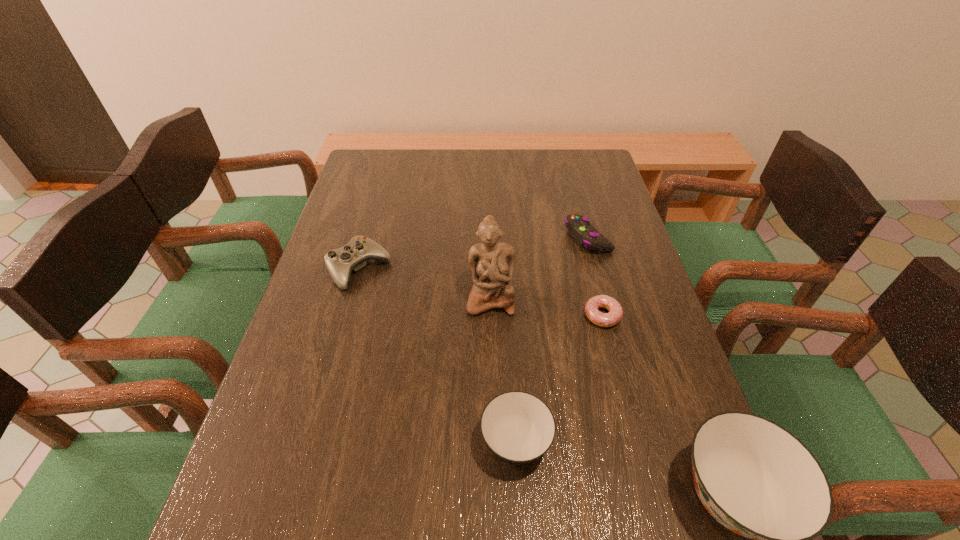
Image resolution: width=960 pixels, height=540 pixels. In the image, there is a desktop. Find the location of `vacant area at the near right corner`. vacant area at the near right corner is located at coordinates (667, 460).

This screenshot has width=960, height=540. What are the coordinates of `unoccupied position between the figurine and the shorter soup bowl` in the screenshot? It's located at (503, 371).

The height and width of the screenshot is (540, 960). I want to click on free spot between the left soup bowl and the doughnut, so click(559, 380).

Identify the location of blank region between the figurine and the second shortest object. (539, 268).

At what (x,y) coordinates should I click in order to perform the action: click on vacant point located between the figurine and the doughnut. Please return your answer as a coordinate pair (x, y). Looking at the image, I should click on coord(546,307).

Where is `free spot between the left control and the figurine`? free spot between the left control and the figurine is located at coordinates (424, 284).

I want to click on empty location between the leftmost object and the shorter soup bowl, so click(x=438, y=356).

Locate an element on the screen. The image size is (960, 540). object that ranks as the closest to the figurine is located at coordinates (615, 314).

Locate which object is the fifth closest to the shortest object. Please provide its 2D coordinates. Your answer should be formatted as a tuple, i.e. [(x, y)], where the tuple contains the x and y coordinates of a point satisfying the conditions above.

[(340, 262)]

The height and width of the screenshot is (540, 960). In order to click on free space that satisfies the following two spatial constraints: 1. on the back side of the left soup bowl; 2. on the right side of the shorter control in this screenshot , I will do `click(504, 237)`.